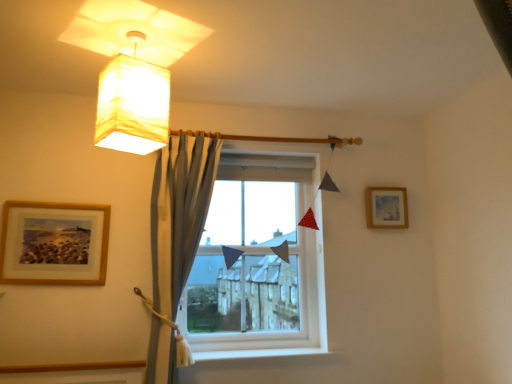
Question: Can you confirm if satin blue curtain at center is bigger than wooden framed picture at upper right, which is the second picture frame from front to back?

Choices:
 (A) yes
 (B) no

Answer: (A)

Question: Considering the relative sizes of satin blue curtain at center and wooden framed picture at upper right, which is the second picture frame from front to back, in the image provided, is satin blue curtain at center taller than wooden framed picture at upper right, which is the second picture frame from front to back,?

Choices:
 (A) no
 (B) yes

Answer: (B)

Question: Can you confirm if satin blue curtain at center is wider than wooden framed picture at upper right, which is the second picture frame from front to back?

Choices:
 (A) yes
 (B) no

Answer: (A)

Question: Is satin blue curtain at center placed right next to wooden framed picture at upper right, which is the second picture frame from front to back?

Choices:
 (A) no
 (B) yes

Answer: (A)

Question: Does satin blue curtain at center contain wooden framed picture at upper right, marked as the 1th picture frame in a right-to-left arrangement?

Choices:
 (A) no
 (B) yes

Answer: (A)

Question: From a real-world perspective, is satin blue curtain at center physically above wooden framed picture at upper right, which is the second picture frame from front to back?

Choices:
 (A) no
 (B) yes

Answer: (A)

Question: Does matte yellow fabric lampshade at upper left contain satin blue curtain at center?

Choices:
 (A) yes
 (B) no

Answer: (B)

Question: Is matte yellow fabric lampshade at upper left further to the viewer compared to satin blue curtain at center?

Choices:
 (A) yes
 (B) no

Answer: (B)

Question: Does matte yellow fabric lampshade at upper left have a smaller size compared to satin blue curtain at center?

Choices:
 (A) no
 (B) yes

Answer: (B)

Question: Considering the relative sizes of matte yellow fabric lampshade at upper left and satin blue curtain at center in the image provided, is matte yellow fabric lampshade at upper left taller than satin blue curtain at center?

Choices:
 (A) yes
 (B) no

Answer: (B)

Question: Is matte yellow fabric lampshade at upper left positioned far away from satin blue curtain at center?

Choices:
 (A) no
 (B) yes

Answer: (A)

Question: Would you say matte yellow fabric lampshade at upper left is outside satin blue curtain at center?

Choices:
 (A) no
 (B) yes

Answer: (B)

Question: Is satin blue curtain at center located outside wooden picture frame at left, which is counted as the second picture frame, starting from the back?

Choices:
 (A) yes
 (B) no

Answer: (A)